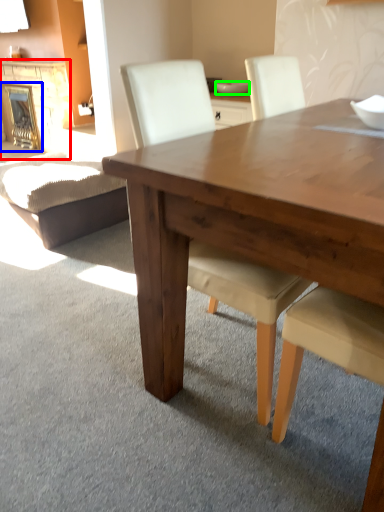
Question: Considering the real-world distances, which object is closest to fireplace (highlighted by a red box)? fireplace (highlighted by a blue box) or bowl (highlighted by a green box).

Choices:
 (A) fireplace
 (B) bowl

Answer: (A)